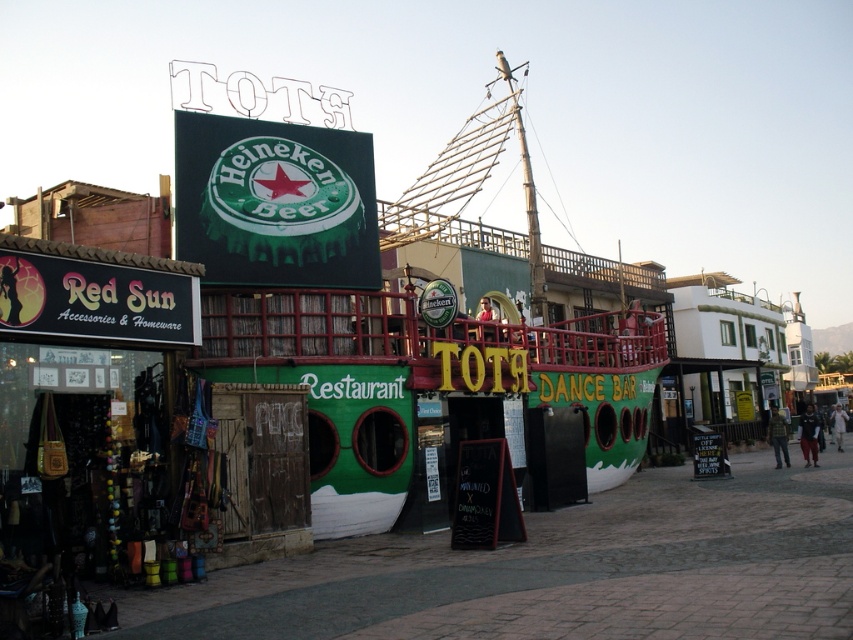
Question: From the image, what is the correct spatial relationship of green matte heineken sign at upper center in relation to green matte boat at center?

Choices:
 (A) left
 (B) right

Answer: (A)

Question: Can you confirm if green matte boat at center is smaller than yellow text on black signboard at lower left?

Choices:
 (A) yes
 (B) no

Answer: (B)

Question: Which of the following is the farthest from the observer?

Choices:
 (A) (610, 410)
 (B) (13, 294)
 (C) (329, 250)

Answer: (A)

Question: Can you confirm if green matte heineken sign at upper center is positioned above green matte boat at center?

Choices:
 (A) yes
 (B) no

Answer: (B)

Question: Considering the real-world distances, which object is farthest from the green matte heineken sign at upper center?

Choices:
 (A) yellow text on black signboard at lower left
 (B) green matte boat at center

Answer: (B)

Question: Estimate the real-world distances between objects in this image. Which object is closer to the green matte boat at center?

Choices:
 (A) green matte heineken sign at upper center
 (B) yellow text on black signboard at lower left

Answer: (A)